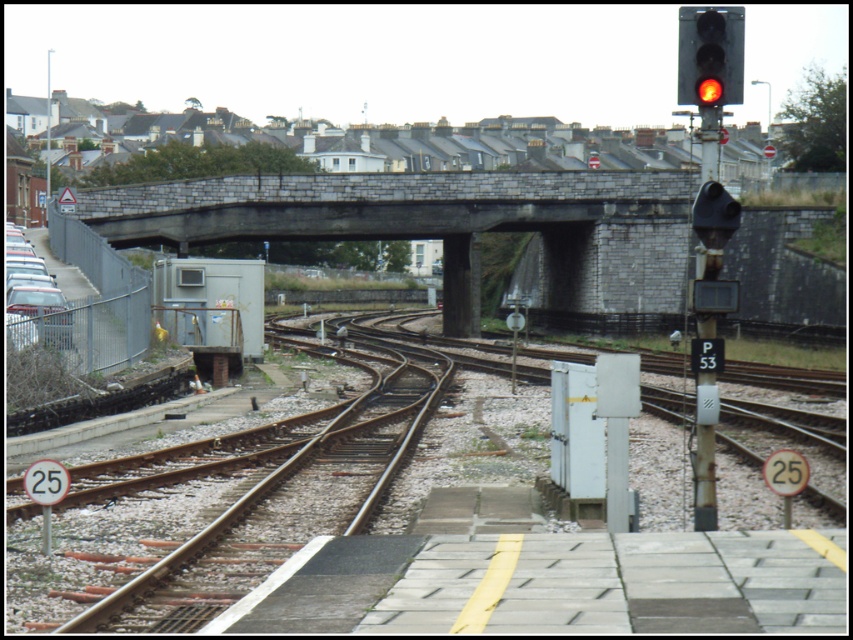
Question: Which point appears closest to the camera in this image?

Choices:
 (A) (743, 28)
 (B) (515, 563)
 (C) (142, 232)
 (D) (720, 241)

Answer: (B)

Question: Does metal train track at center appear over black plastic traffic light at upper right?

Choices:
 (A) yes
 (B) no

Answer: (B)

Question: Can you confirm if metal train track at center is positioned to the left of stone bridge at center?

Choices:
 (A) no
 (B) yes

Answer: (A)

Question: Is the position of metal train track at center less distant than that of black plastic traffic light at upper right?

Choices:
 (A) yes
 (B) no

Answer: (A)

Question: Which point is closer to the camera?

Choices:
 (A) (737, 204)
 (B) (519, 193)
 (C) (248, 476)
 (D) (737, 51)

Answer: (A)

Question: Which point appears closest to the camera in this image?

Choices:
 (A) (450, 228)
 (B) (718, 67)
 (C) (305, 538)
 (D) (692, 218)

Answer: (B)